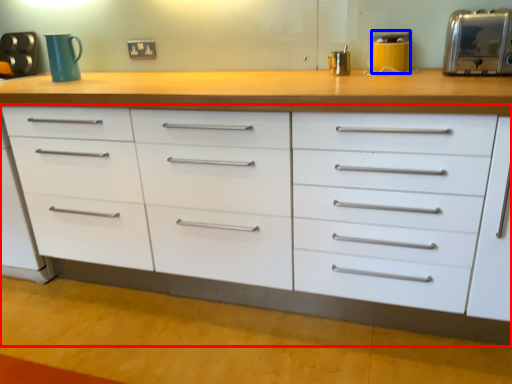
Question: Which of the following is the closest to the observer, chest of drawers (highlighted by a red box) or appliance (highlighted by a blue box)?

Choices:
 (A) chest of drawers
 (B) appliance

Answer: (A)